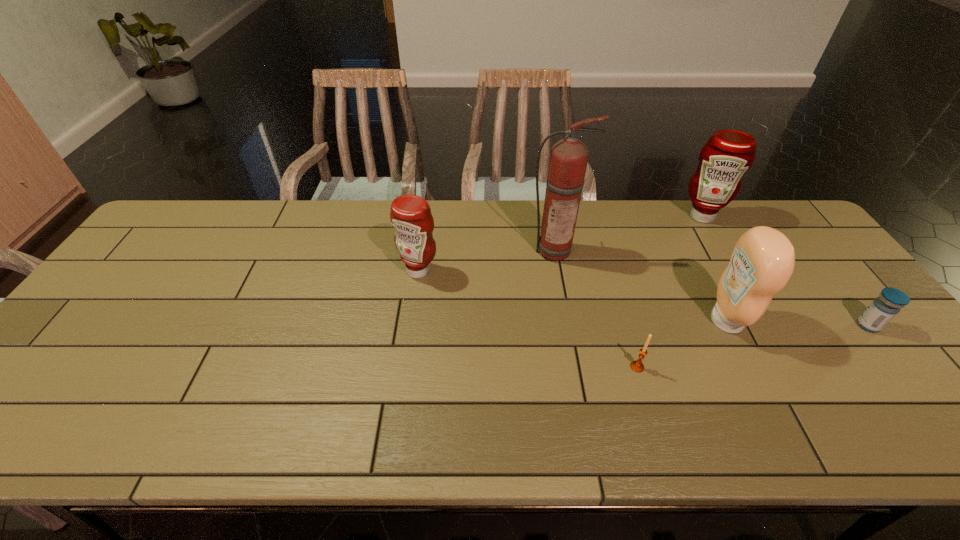
Locate an element on the screen. the fifth object from right to left is located at coordinates click(568, 160).

Locate an element on the screen. The image size is (960, 540). the tallest object is located at coordinates (568, 160).

Where is `the farthest object`? the farthest object is located at coordinates (726, 156).

At what (x,y) coordinates should I click in order to perform the action: click on the nearest condiment. Please return your answer as a coordinate pair (x, y). This screenshot has height=540, width=960. Looking at the image, I should click on (763, 259).

Find the location of `the leftmost condiment`. the leftmost condiment is located at coordinates (410, 215).

Find the location of a particular element. the leftmost object is located at coordinates (410, 215).

The height and width of the screenshot is (540, 960). What are the coordinates of `the nearest object` in the screenshot? It's located at (637, 365).

The width and height of the screenshot is (960, 540). I want to click on the third object from left to right, so coord(637,365).

Find the location of a particular element. the rightmost object is located at coordinates (883, 309).

Find the location of a particular element. The image size is (960, 540). free region located on the side of the fire extinguisher with the label and nozzle is located at coordinates (569, 336).